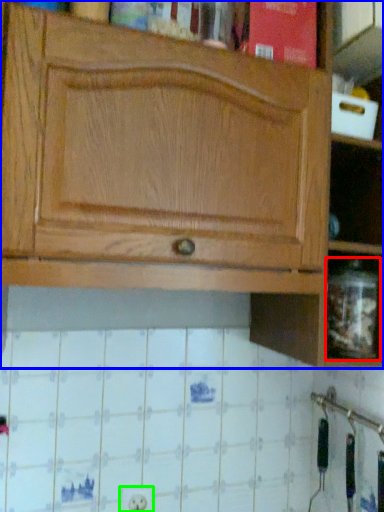
Question: Which object is the closest to the glass jar (highlighted by a red box)? Choose among these: cabinetry (highlighted by a blue box) or electric outlet (highlighted by a green box).

Choices:
 (A) cabinetry
 (B) electric outlet

Answer: (A)